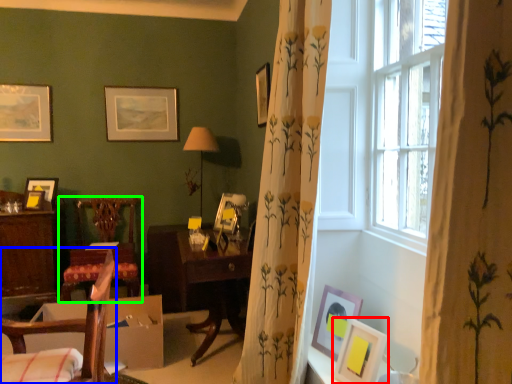
Question: Considering the real-world distances, which object is closest to picture frame (highlighted by a red box)? chair (highlighted by a blue box) or chair (highlighted by a green box).

Choices:
 (A) chair
 (B) chair

Answer: (A)